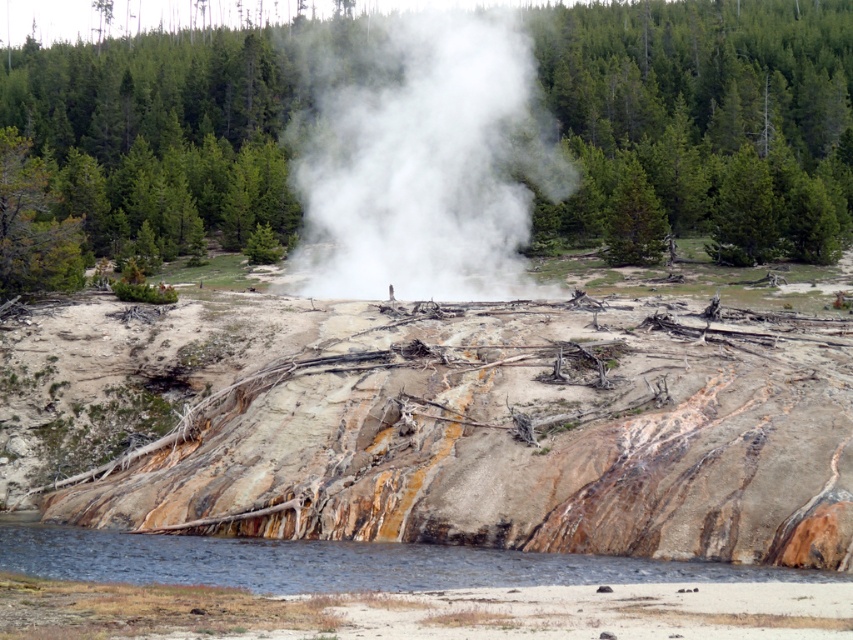
Question: Can you confirm if white vapor at center is positioned below clear water at lower left?

Choices:
 (A) yes
 (B) no

Answer: (B)

Question: Based on their relative distances, which object is farther from the clear water at lower left?

Choices:
 (A) green leafy tree at center
 (B) white vapor at center

Answer: (A)

Question: Where is green leafy tree at center located in relation to clear water at lower left in the image?

Choices:
 (A) below
 (B) above

Answer: (B)

Question: Is white vapor at center smaller than clear water at lower left?

Choices:
 (A) no
 (B) yes

Answer: (A)

Question: Among these objects, which one is nearest to the camera?

Choices:
 (A) green leafy tree at center
 (B) white vapor at center

Answer: (A)

Question: Among these objects, which one is nearest to the camera?

Choices:
 (A) green leafy tree at center
 (B) clear water at lower left

Answer: (B)